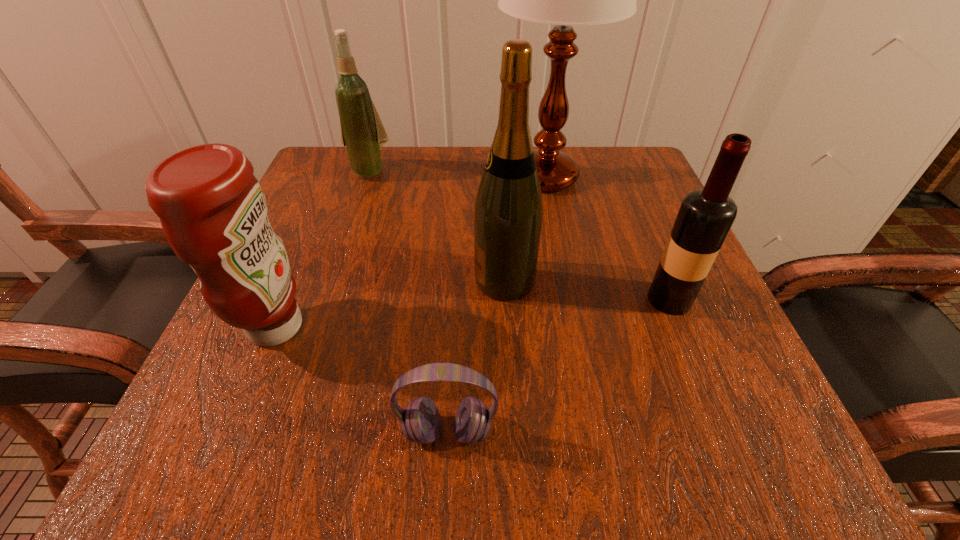
Identify the location of vacant space located 0.360m on the front-facing side of the second tallest object. Image resolution: width=960 pixels, height=540 pixels. (264, 280).

Where is `vacant space situated on the front-facing side of the second tallest object`? The width and height of the screenshot is (960, 540). vacant space situated on the front-facing side of the second tallest object is located at coordinates (282, 280).

Find the location of `free space located 0.150m on the front-facing side of the leftmost wine bottle`. free space located 0.150m on the front-facing side of the leftmost wine bottle is located at coordinates (350, 225).

In order to click on vacant space located on the left of the rightmost wine bottle in this screenshot , I will do `click(575, 299)`.

This screenshot has height=540, width=960. Identify the location of free space located on the back of the condiment. (312, 238).

Where is `table lamp at the far edge`? table lamp at the far edge is located at coordinates (565, 0).

This screenshot has height=540, width=960. In order to click on wine bottle present at the far edge in this screenshot , I will do `click(362, 132)`.

Find the location of a particular element. This screenshot has width=960, height=540. object that is at the near edge is located at coordinates (420, 421).

What are the coordinates of `wine bottle situated at the left edge` in the screenshot? It's located at (362, 132).

I want to click on condiment that is at the left edge, so click(x=213, y=212).